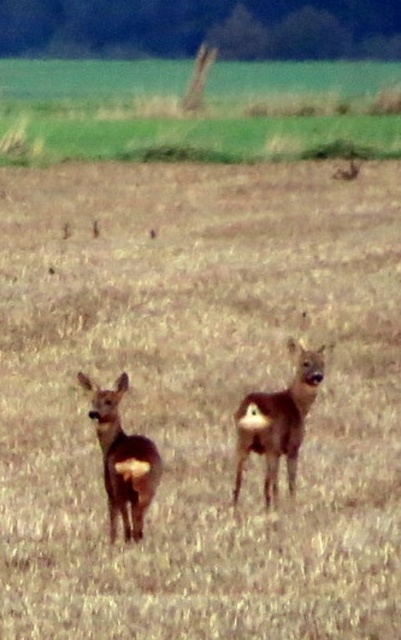
Question: Which object appears closest to the camera in this image?

Choices:
 (A) brown matte deer at center
 (B) brown matte roe deer at center

Answer: (B)

Question: Does brown matte deer at center appear under brown matte roe deer at center?

Choices:
 (A) yes
 (B) no

Answer: (B)

Question: Observing the image, what is the correct spatial positioning of brown matte deer at center in reference to brown matte roe deer at center?

Choices:
 (A) right
 (B) left

Answer: (A)

Question: Among these points, which one is nearest to the camera?

Choices:
 (A) (129, 484)
 (B) (309, 400)

Answer: (A)

Question: Does brown matte deer at center appear under brown matte roe deer at center?

Choices:
 (A) no
 (B) yes

Answer: (A)

Question: Which point is closer to the camera taking this photo?

Choices:
 (A) (313, 365)
 (B) (153, 474)

Answer: (B)